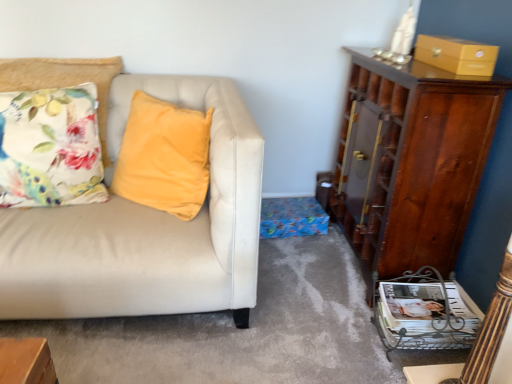
Question: From a real-world perspective, relative to matte yellow box at upper right, is white glossy magazine at lower right vertically above or below?

Choices:
 (A) below
 (B) above

Answer: (A)

Question: Considering the positions of white glossy magazine at lower right and matte yellow box at upper right in the image, is white glossy magazine at lower right wider or thinner than matte yellow box at upper right?

Choices:
 (A) wide
 (B) thin

Answer: (A)

Question: Estimate the real-world distances between objects in this image. Which object is farther from the white glossy magazine at lower right?

Choices:
 (A) floral fabric cushion at left
 (B) shiny brown cabinet at right
 (C) matte yellow box at upper right

Answer: (A)

Question: Which is nearer to the floral fabric cushion at left?

Choices:
 (A) matte yellow box at upper right
 (B) shiny brown cabinet at right
 (C) white glossy magazine at lower right

Answer: (B)